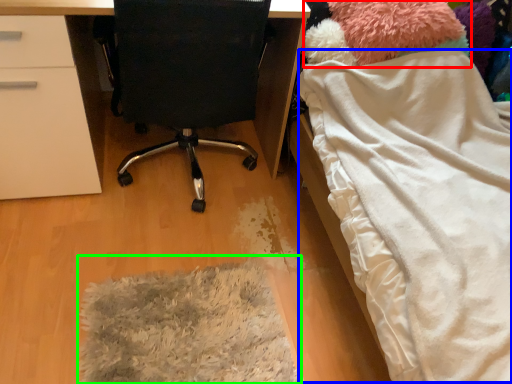
Question: Considering the real-world distances, which object is farthest from teddy (highlighted by a red box)? blanket (highlighted by a blue box) or mat (highlighted by a green box)?

Choices:
 (A) blanket
 (B) mat

Answer: (B)